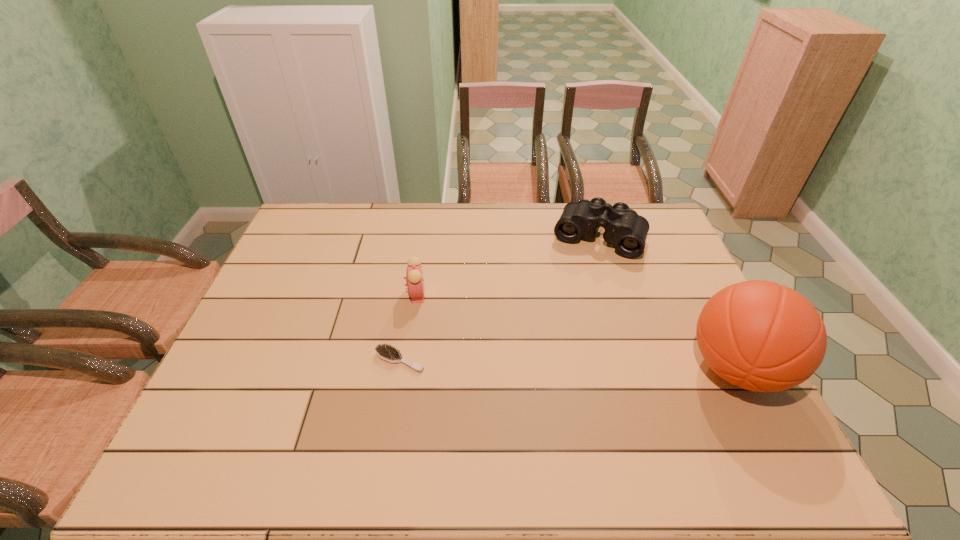
Where is `the shortest object`? This screenshot has width=960, height=540. the shortest object is located at coordinates (388, 353).

Where is `the tallest object`? The image size is (960, 540). the tallest object is located at coordinates (761, 336).

Where is `alarm clock`? alarm clock is located at coordinates (414, 276).

Where is `binoculars`? This screenshot has height=540, width=960. binoculars is located at coordinates point(624,228).

This screenshot has width=960, height=540. I want to click on vacant area located on the front of the shortest object, so click(x=392, y=411).

Where is `free space located on the back of the tallest object`? This screenshot has width=960, height=540. free space located on the back of the tallest object is located at coordinates tap(703, 301).

Locate an element on the screen. vacant space situated 0.190m on the face of the alarm clock is located at coordinates (478, 326).

Locate an element on the screen. This screenshot has width=960, height=540. vacant space located 0.250m on the face of the alarm clock is located at coordinates (496, 335).

What are the coordinates of `vacant region located 0.240m on the face of the alarm clock` in the screenshot? It's located at pos(492,333).

The height and width of the screenshot is (540, 960). What are the coordinates of `free space located 0.340m at the eyepieces of the binoculars` in the screenshot? It's located at (559, 333).